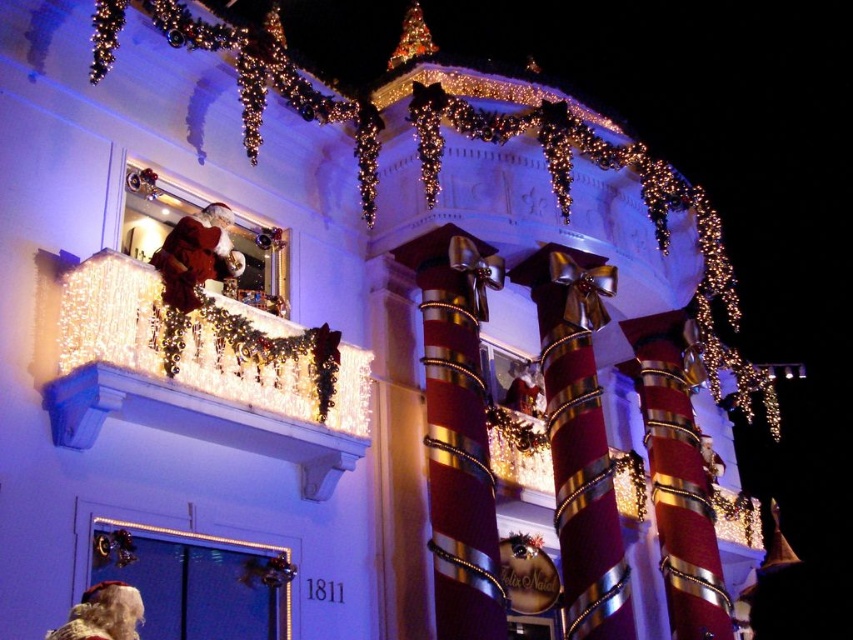
You are standing in front of the festive building and notice the illuminated glass balcony at upper center and the illuminated white lights at balcony left. Which of these two objects is positioned further to the left?

The illuminated glass balcony at upper center is positioned to the left of the illuminated white lights at balcony left, so the illuminated glass balcony at upper center is further to the left.

You are a drone operator tasked with capturing aerial footage of the festive building. Your drone has a maximum flight range of 20 meters. If you position the drone at the illuminated glass balcony at upper center, can it reach the illuminated white lights at balcony left without exceeding its range?

The illuminated glass balcony at upper center and the illuminated white lights at balcony left are 20.27 meters apart. Since the drone has a maximum flight range of 20 meters, it cannot reach the illuminated white lights at balcony left without exceeding its range.

You are a delivery drone that needs to pass between the illuminated glass balcony at upper center and the illuminated white lights at balcony left. The drone has a wingspan of 1 meter. Can you safely navigate through the space between them?

The illuminated glass balcony at upper center is narrower than the illuminated white lights at balcony left. Since the balcony is narrower, the space between them may be too tight for the drone with a 1 meter wingspan. However, without exact measurements, it is uncertain. The description only states the balcony is less wide than the lights, but the distance between them isn not specified. Therefore, it is not possible to determine safety based on the given information.